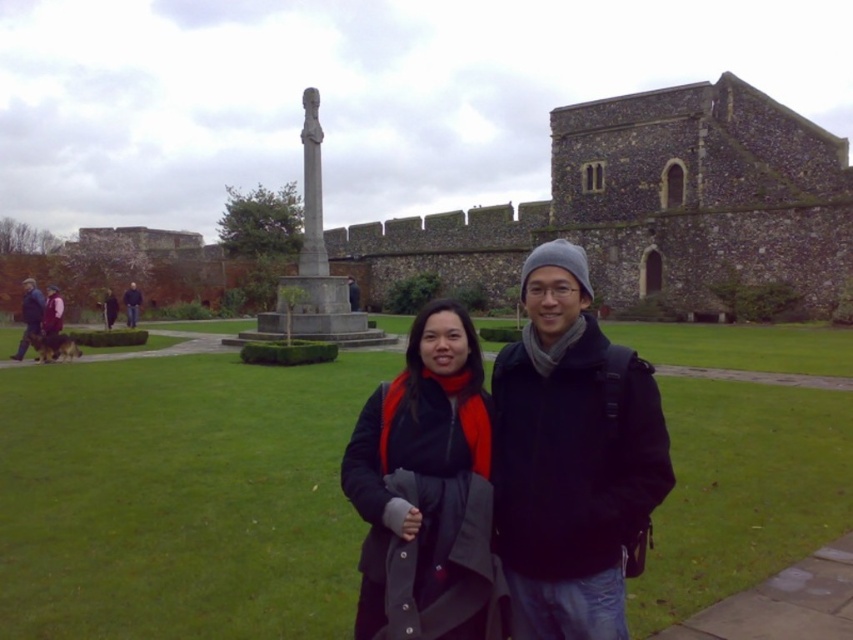
Question: Can you confirm if green grass at center is bigger than red fleece jacket at center?

Choices:
 (A) no
 (B) yes

Answer: (B)

Question: Observing the image, what is the correct spatial positioning of green grass at center in reference to gray stone statue at center?

Choices:
 (A) above
 (B) below

Answer: (B)

Question: Estimate the real-world distances between objects in this image. Which object is closer to the green grass at center?

Choices:
 (A) gray stone statue at center
 (B) dark brown leather jacket at lower left

Answer: (A)

Question: Which point is farther to the camera?

Choices:
 (A) green grass at center
 (B) dark blue jacket at left
 (C) dark brown leather jacket at lower left

Answer: (C)

Question: Can you confirm if gray stone statue at center is positioned to the left of dark brown leather jacket at lower left?

Choices:
 (A) yes
 (B) no

Answer: (B)

Question: Which of the following is the closest to the observer?

Choices:
 (A) matte black jacket at center
 (B) dark brown leather jacket at lower left

Answer: (A)